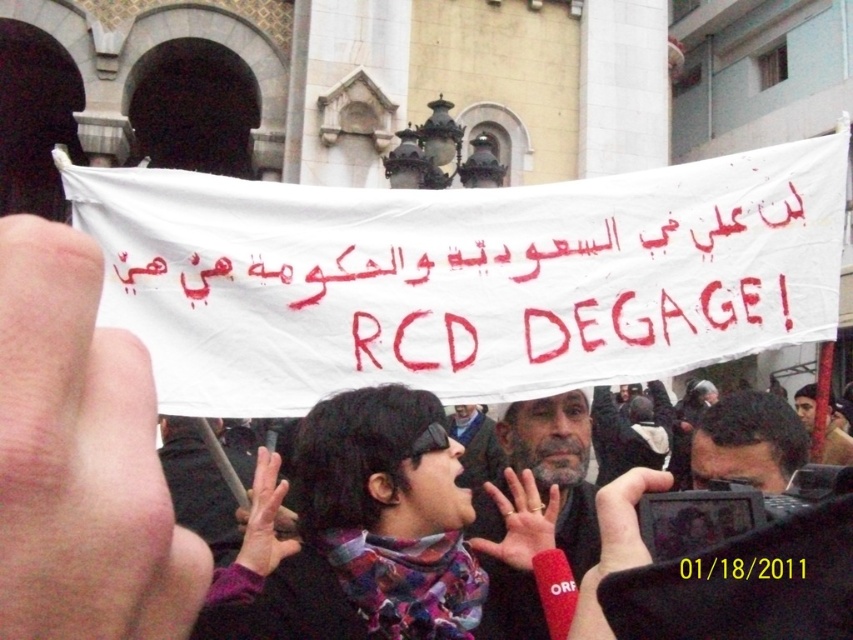
Is dark hair at center thinner than black paper at center?

Incorrect, dark hair at center's width is not less than black paper at center's.

Is dark hair at center closer to the viewer compared to black paper at center?

No, dark hair at center is behind black paper at center.

Locate an element on the screen. The height and width of the screenshot is (640, 853). dark hair at center is located at coordinates pyautogui.click(x=747, y=442).

Does gray matte helmet at center appear on the left side of dark brown leather jacket at center?

Correct, you'll find gray matte helmet at center to the left of dark brown leather jacket at center.

Does gray matte helmet at center have a lesser width compared to dark brown leather jacket at center?

Yes.

You are a GUI agent. You are given a task and a screenshot of the screen. Output one action in this format:
    pyautogui.click(x=<x>, y=<y>)
    Task: Click on the gray matte helmet at center
    This screenshot has width=853, height=640.
    Given the screenshot: What is the action you would take?
    pyautogui.click(x=532, y=508)

Who is shorter, dark hair at center or dark brown leather jacket at center?

With less height is dark brown leather jacket at center.

Is dark hair at center to the left of dark brown leather jacket at center from the viewer's perspective?

Indeed, dark hair at center is positioned on the left side of dark brown leather jacket at center.

The width and height of the screenshot is (853, 640). What do you see at coordinates (747, 442) in the screenshot? I see `dark hair at center` at bounding box center [747, 442].

This screenshot has width=853, height=640. I want to click on dark hair at center, so click(x=747, y=442).